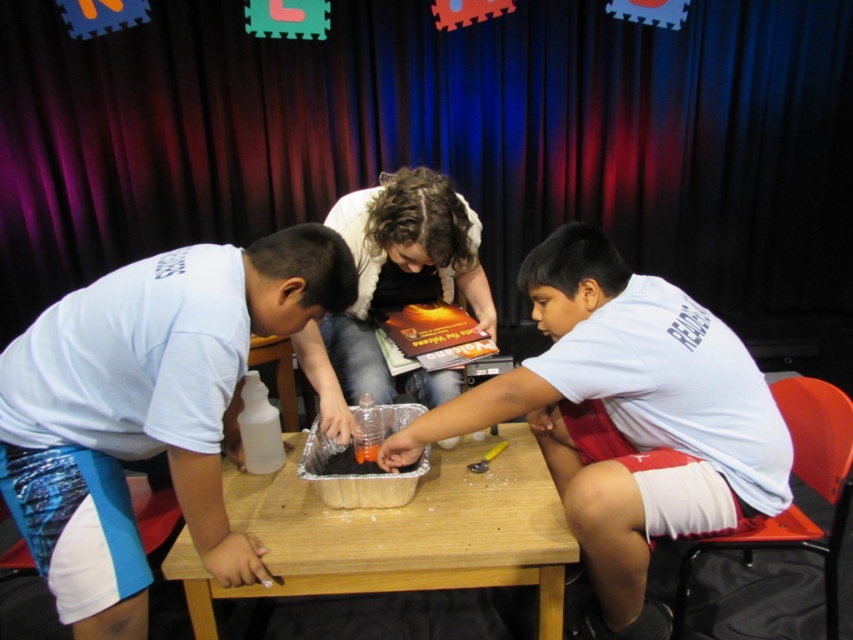
Between white matte shirt at left and white matte shirt at center, which one is positioned lower?

white matte shirt at center is lower down.

Looking at this image, does white matte shirt at left have a lesser height compared to white matte shirt at center?

Correct, white matte shirt at left is not as tall as white matte shirt at center.

Is point (112, 355) farther from viewer compared to point (595, 342)?

No, (112, 355) is closer to viewer.

This screenshot has height=640, width=853. In order to click on white matte shirt at left in this screenshot , I will do `click(148, 410)`.

Is point (115, 406) farther from camera compared to point (177, 570)?

No, (115, 406) is in front of (177, 570).

Who is more forward, (102, 467) or (494, 580)?

Point (102, 467) is in front.

Who is more distant from viewer, (90, 310) or (265, 557)?

The point (265, 557) is behind.

Find the location of a particular element. white matte shirt at left is located at coordinates coord(148,410).

Looking at this image, can you confirm if white matte shirt at center is wider than wooden table at center?

Correct, the width of white matte shirt at center exceeds that of wooden table at center.

Between point (671, 449) and point (532, 476), which one is positioned behind?

The point (532, 476) is behind.

Who is more forward, (x=648, y=282) or (x=338, y=580)?

Point (x=338, y=580)

Image resolution: width=853 pixels, height=640 pixels. Find the location of `white matte shirt at center`. white matte shirt at center is located at coordinates (627, 413).